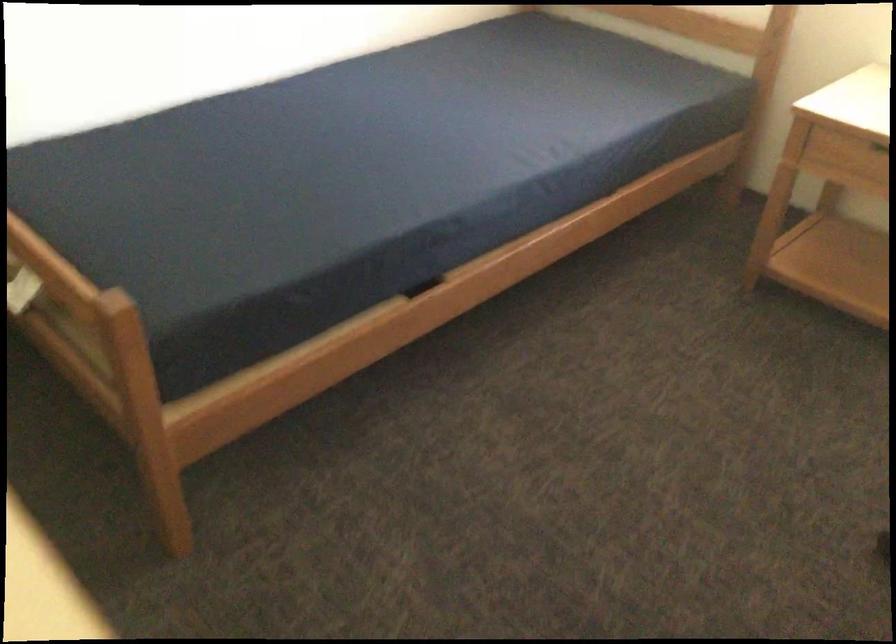
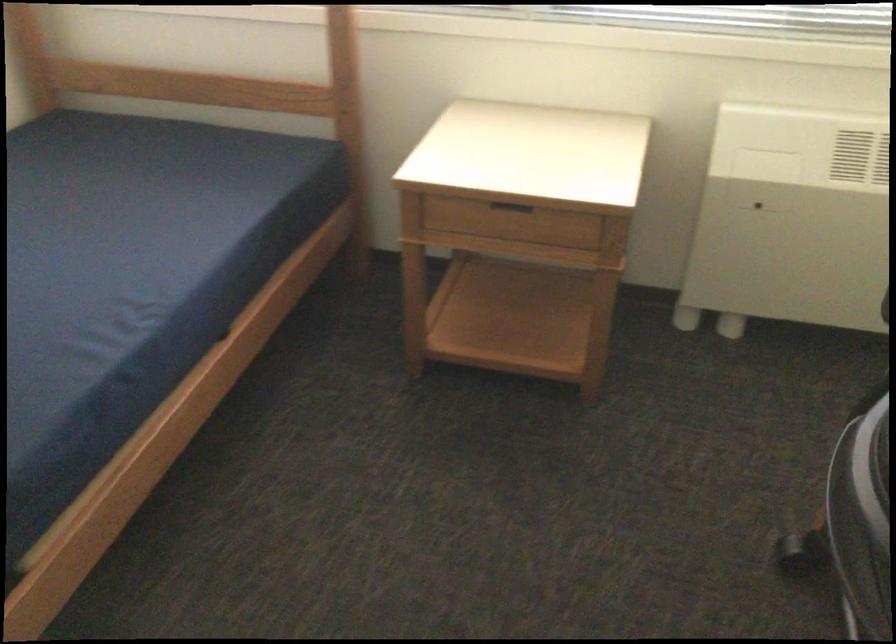
Question: The first image is from the beginning of the video and the second image is from the end. How did the camera likely rotate when shooting the video?

Choices:
 (A) Left
 (B) Right
 (C) Up
 (D) Down

Answer: (B)